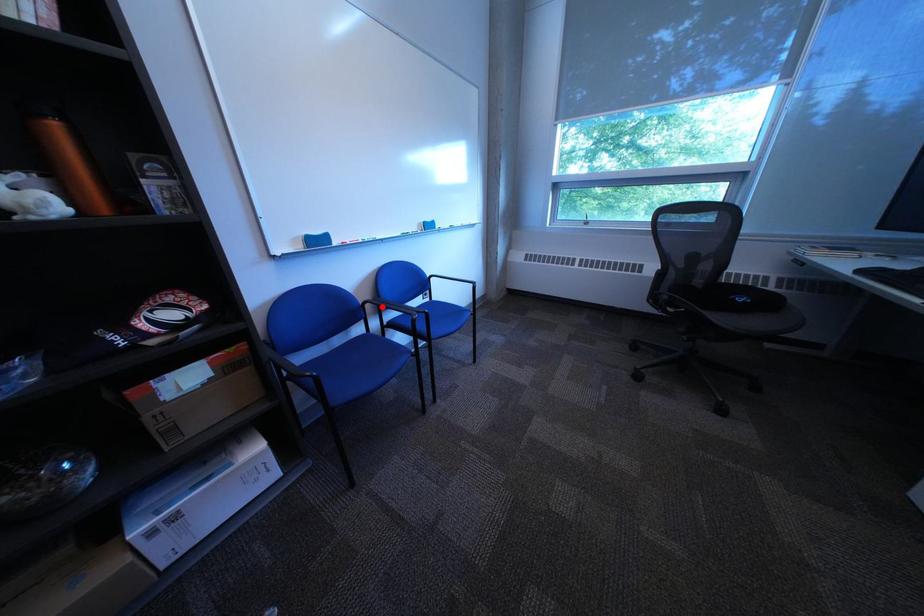
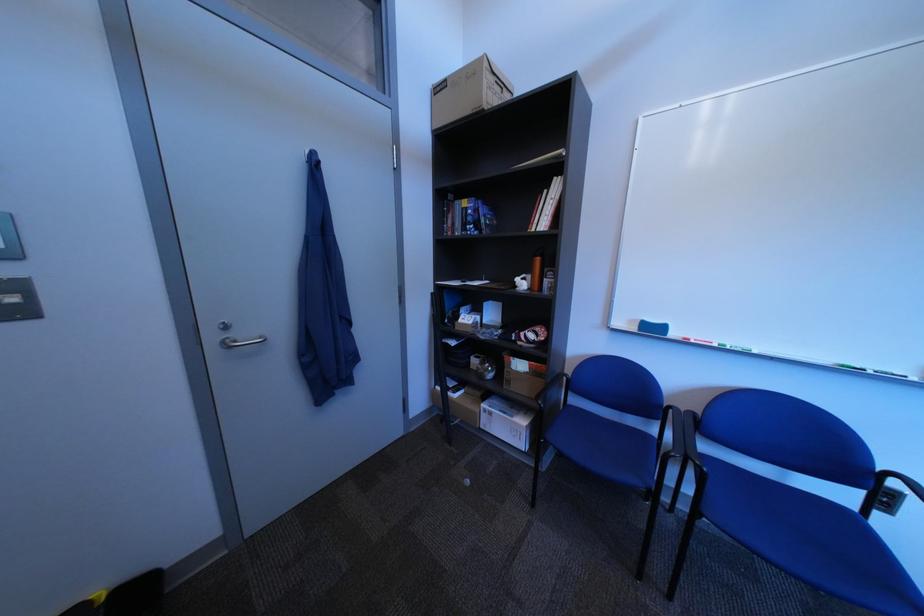
Find the pixel in the second image that matches the highlighted location in the first image.

(687, 413)